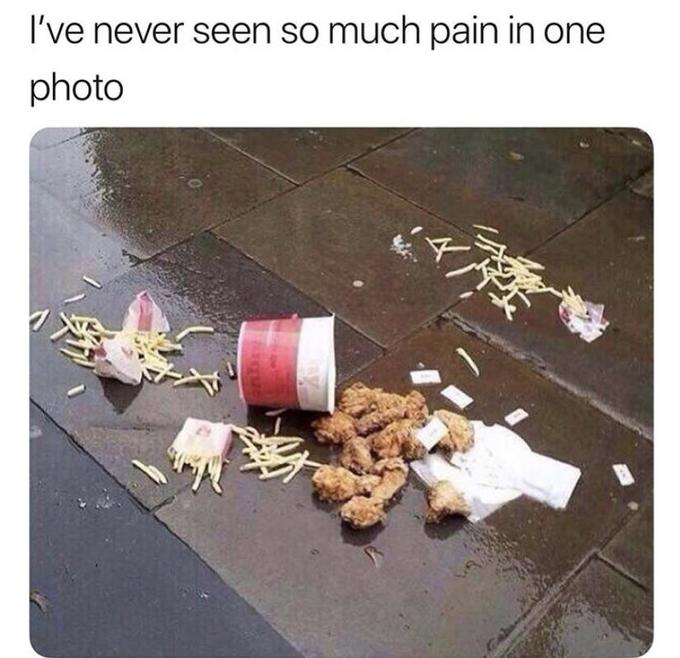
Find the location of a particular element. wet paper napkins next to the spilled chicken pieces is located at coordinates (490, 464).